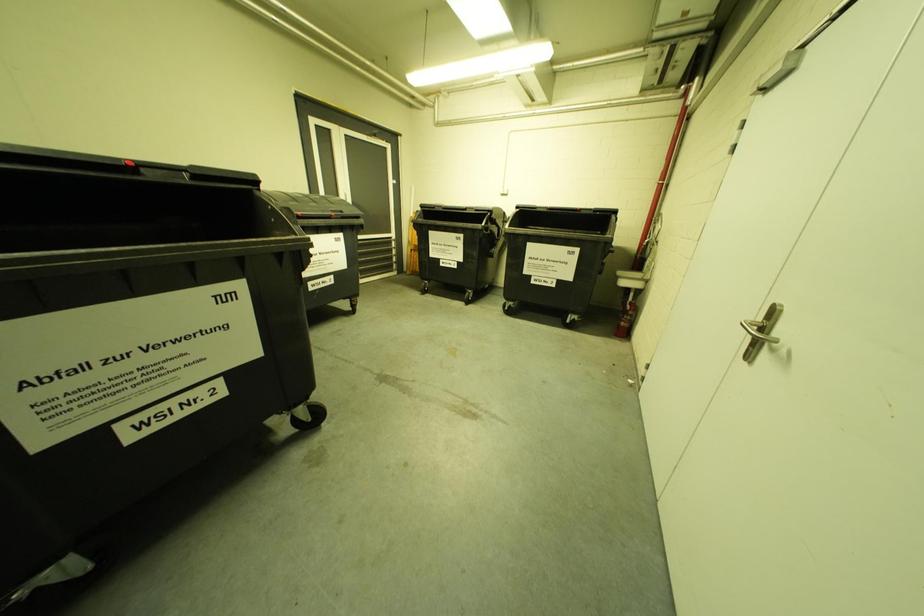
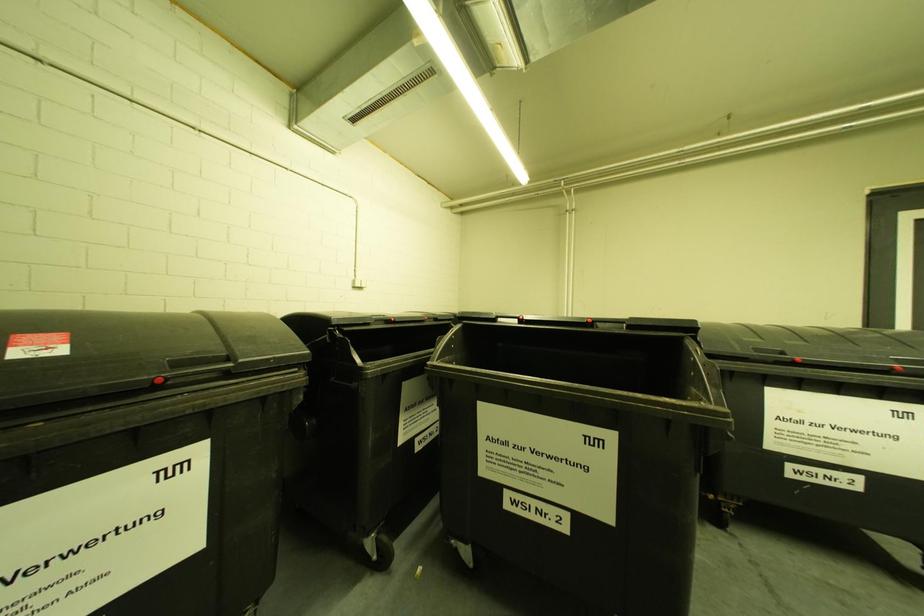
Question: The camera is either moving clockwise (left) or counter-clockwise (right) around the object. The first image is from the beginning of the video and the second image is from the end. Is the camera moving left or right when shooting the video?

Choices:
 (A) Left
 (B) Right

Answer: (B)